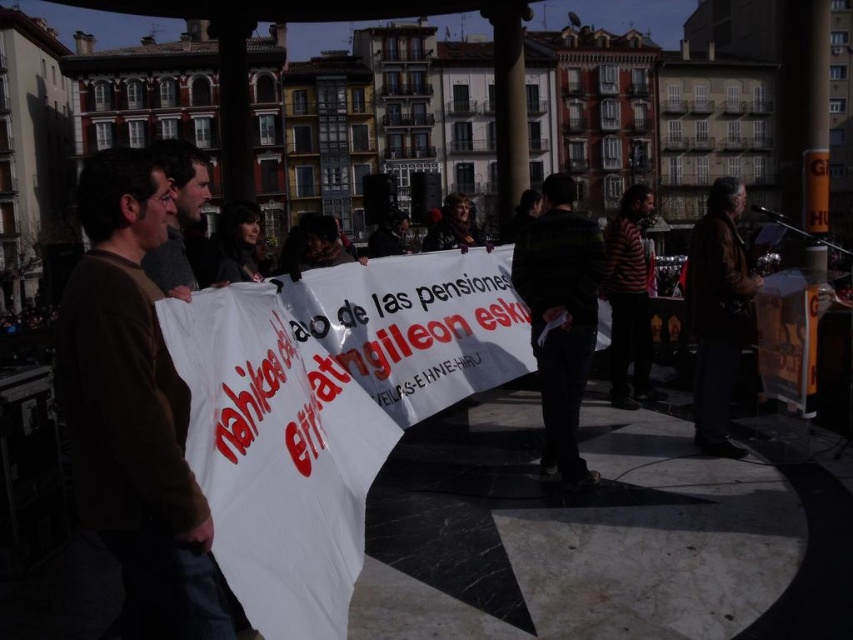
Looking at this image, you are a photographer trying to capture both the brown sweater at left and the brown leather jacket at right in a single frame. Based on their positions, which one should you adjust your camera to focus on first to ensure both are in the frame?

Since the brown sweater at left is to the left of the brown leather jacket at right, you should focus on the brown leather jacket at right first, then adjust the camera to include the brown sweater at left in the frame.

You are a photographer standing at the camera position. You want to capture a closeup shot of the brown sweater at left. Given that your zoom lens can focus as close as 100 feet, will you be able to take the photo without moving closer?

The distance between the brown sweater at left and the camera is 119.47 feet, which is beyond the 100 feet minimum focusing distance of the zoom lens. Therefore, you cannot take a closeup shot without moving closer.

You are a photographer standing in the plaza and see two people wearing the brown sweater at left and the gray knit sweater at left. Which sweater is more visible to you?

The brown sweater at left is closer to the viewer than the gray knit sweater at left, so the brown sweater at left is more visible.